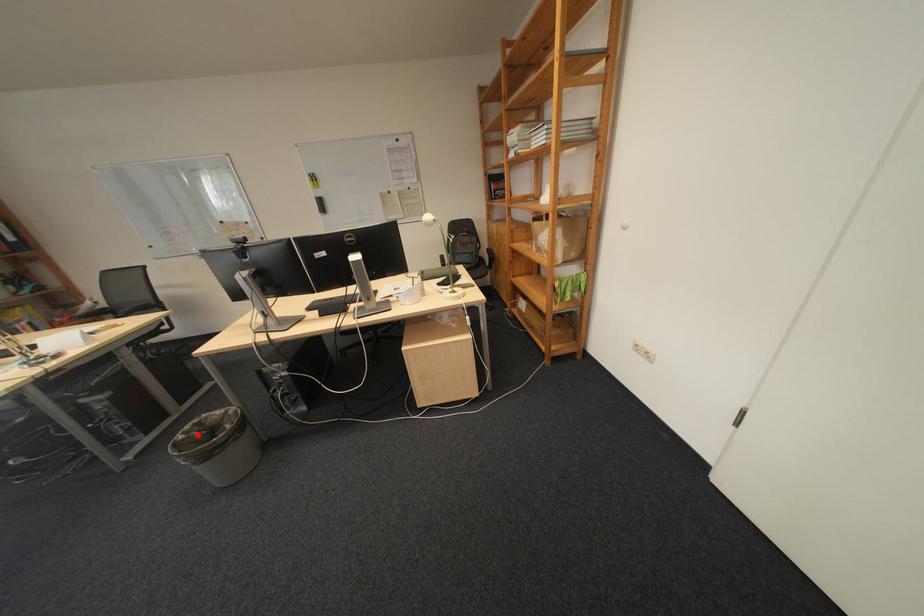
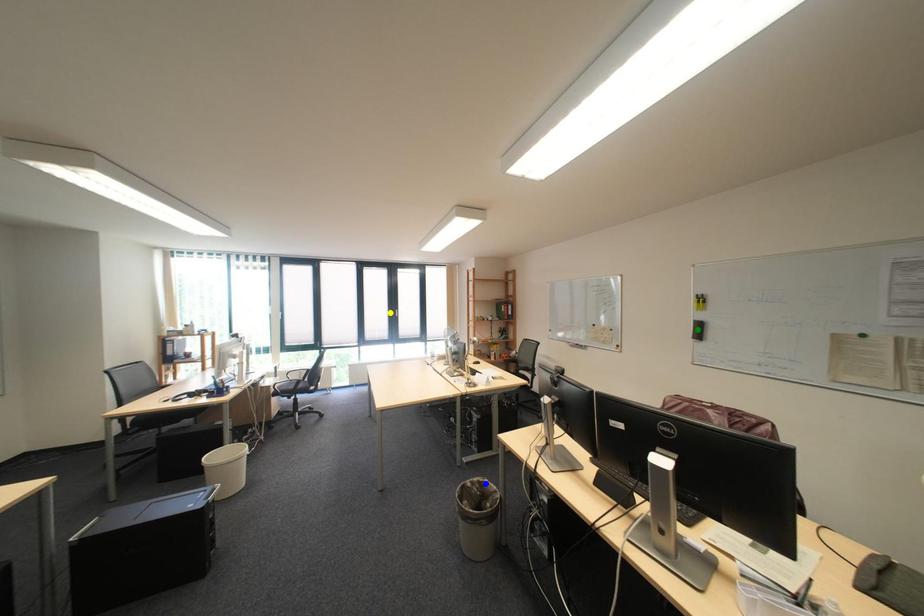
Question: I am providing you with two images of the same scene from different viewpoints. A red point is marked on the first image. You are given multiple points on the second image. Can you choose the point in image 2 that corresponds to the point in image 1?

Choices:
 (A) green point
 (B) blue point
 (C) yellow point

Answer: (B)